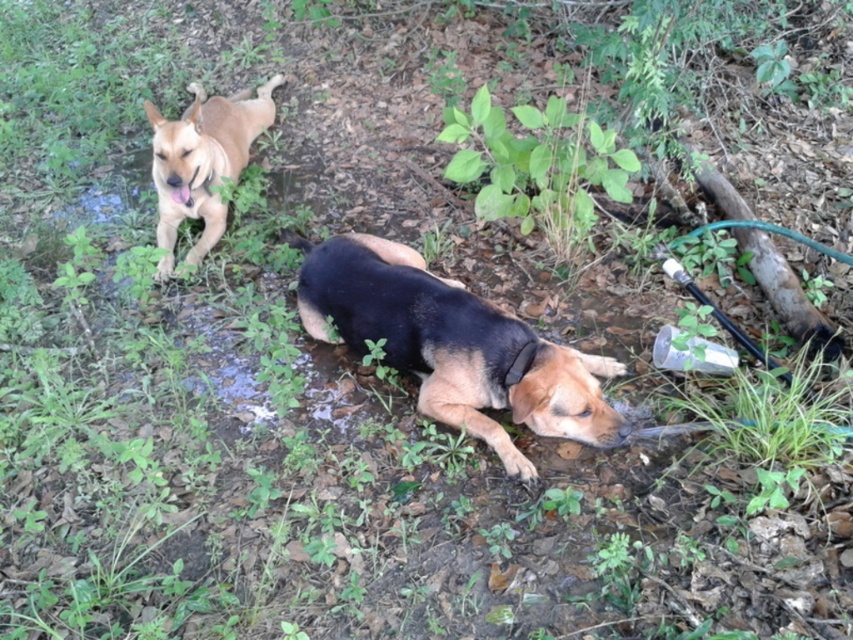
The width and height of the screenshot is (853, 640). Find the location of `black smooth dog at center`. black smooth dog at center is located at coordinates (453, 346).

Which is more to the left, black smooth dog at center or light brown fur at upper left?

Positioned to the left is light brown fur at upper left.

Is point (531, 368) farther from viewer compared to point (207, 104)?

No, (531, 368) is in front of (207, 104).

The height and width of the screenshot is (640, 853). I want to click on black smooth dog at center, so click(x=453, y=346).